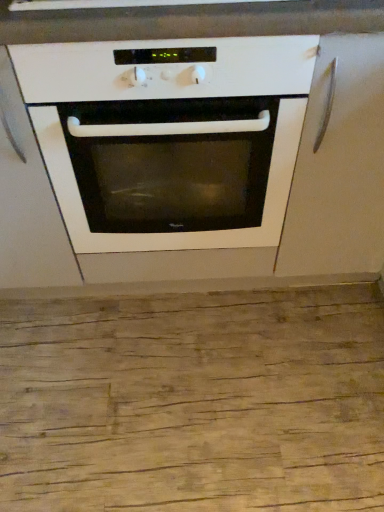
Question: Is white glossy oven at center oriented away from matte white cabinet at right, which is the second cabinetry in left-to-right order?

Choices:
 (A) yes
 (B) no

Answer: (B)

Question: Does white glossy oven at center have a smaller size compared to matte white cabinet at right, which is the second cabinetry in left-to-right order?

Choices:
 (A) yes
 (B) no

Answer: (B)

Question: From the image's perspective, is white glossy oven at center above matte white cabinet at right, the first cabinetry from the right?

Choices:
 (A) no
 (B) yes

Answer: (A)

Question: From a real-world perspective, is white glossy oven at center beneath matte white cabinet at right, the first cabinetry from the right?

Choices:
 (A) yes
 (B) no

Answer: (A)

Question: Does white glossy oven at center have a larger size compared to matte white cabinet at right, the first cabinetry from the right?

Choices:
 (A) no
 (B) yes

Answer: (B)

Question: Is white matte cabinet at center, arranged as the 2th cabinetry when viewed from the right, in front of or behind matte white cabinet at right, which is the second cabinetry in left-to-right order, in the image?

Choices:
 (A) behind
 (B) front

Answer: (B)

Question: From the image's perspective, is white matte cabinet at center, the first cabinetry from the left, above or below matte white cabinet at right, the first cabinetry from the right?

Choices:
 (A) above
 (B) below

Answer: (B)

Question: From a real-world perspective, is white matte cabinet at center, arranged as the 2th cabinetry when viewed from the right, above or below matte white cabinet at right, which is the second cabinetry in left-to-right order?

Choices:
 (A) below
 (B) above

Answer: (A)

Question: From their relative heights in the image, would you say white matte cabinet at center, the first cabinetry from the left, is taller or shorter than matte white cabinet at right, the first cabinetry from the right?

Choices:
 (A) tall
 (B) short

Answer: (B)

Question: Considering the positions of white glossy oven at center and matte white cabinet at right, the first cabinetry from the right, in the image, is white glossy oven at center wider or thinner than matte white cabinet at right, the first cabinetry from the right,?

Choices:
 (A) thin
 (B) wide

Answer: (A)

Question: In terms of height, does white glossy oven at center look taller or shorter compared to matte white cabinet at right, the first cabinetry from the right?

Choices:
 (A) tall
 (B) short

Answer: (A)

Question: Is white glossy oven at center bigger or smaller than matte white cabinet at right, which is the second cabinetry in left-to-right order?

Choices:
 (A) small
 (B) big

Answer: (B)

Question: Based on their positions, is white glossy oven at center located to the left or right of matte white cabinet at right, the first cabinetry from the right?

Choices:
 (A) right
 (B) left

Answer: (B)

Question: From a real-world perspective, is white glossy oven at center physically located above or below white matte cabinet at center, arranged as the 2th cabinetry when viewed from the right?

Choices:
 (A) above
 (B) below

Answer: (B)

Question: Is white glossy oven at center taller or shorter than white matte cabinet at center, the first cabinetry from the left?

Choices:
 (A) tall
 (B) short

Answer: (A)